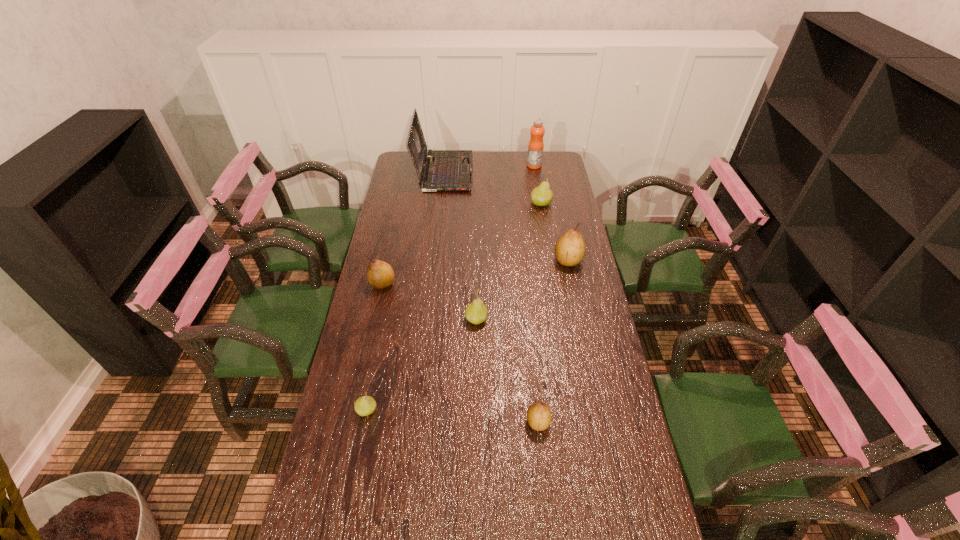
Where is `free space that satisfies the following two spatial constraints: 1. on the screen of the laptop computer; 2. on the right side of the biggest green pear`? The height and width of the screenshot is (540, 960). free space that satisfies the following two spatial constraints: 1. on the screen of the laptop computer; 2. on the right side of the biggest green pear is located at coordinates (441, 204).

Locate an element on the screen. The image size is (960, 540). free location that satisfies the following two spatial constraints: 1. on the back side of the biggest green pear; 2. on the right side of the smallest green pear is located at coordinates (408, 204).

The height and width of the screenshot is (540, 960). What are the coordinates of `free space that satisfies the following two spatial constraints: 1. on the front side of the third pear from right to left; 2. on the right side of the second smallest green pear` in the screenshot? It's located at (475, 422).

Identify the location of free region that satisfies the following two spatial constraints: 1. on the back side of the biggest green pear; 2. on the left side of the smallest brown pear. (x=516, y=204).

The width and height of the screenshot is (960, 540). I want to click on vacant region that satisfies the following two spatial constraints: 1. on the screen of the laptop computer; 2. on the back side of the third nearest pear, so click(x=428, y=319).

Identify the location of free spot that satisfies the following two spatial constraints: 1. on the front side of the fourth pear from left to right; 2. on the left side of the smallest green pear. The height and width of the screenshot is (540, 960). (365, 422).